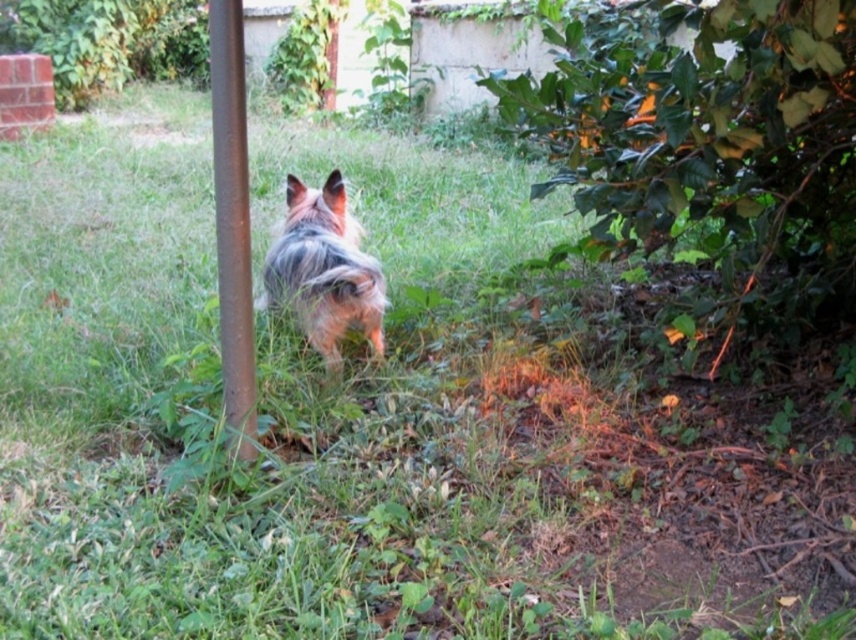
Does rusty metal pole at center-left come in front of fuzzy brown dog at center?

That is True.

Which is behind, point (221, 330) or point (345, 257)?

The point (345, 257) is more distant.

Locate an element on the screen. Image resolution: width=856 pixels, height=640 pixels. rusty metal pole at center-left is located at coordinates (232, 224).